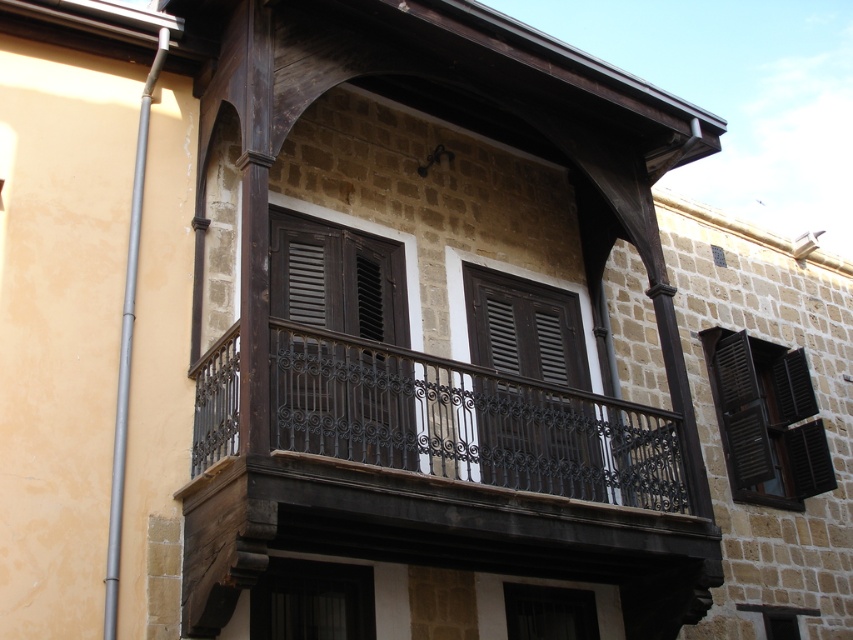
You are an architect designing a new building and want to place a decorative pipe at the same vertical position as the black matte wood window at center. What coordinate should you use for the vertical position?

The vertical position of the black matte wood window at center is 0.899, so you should place the decorative pipe at the vertical coordinate 0.899.

You are an architect designing a new building and want to place a window exactly at the coordinates mentioned in the scene description. What are the coordinates where the matte dark brown wooden window at center is located?

The matte dark brown wooden window at center is located at coordinates point (537, 438).

You are standing in front of the building and notice a point marked at coordinates (766, 419). What object does this point correspond to?

The point at coordinates (766, 419) corresponds to the black matte wood window at center.